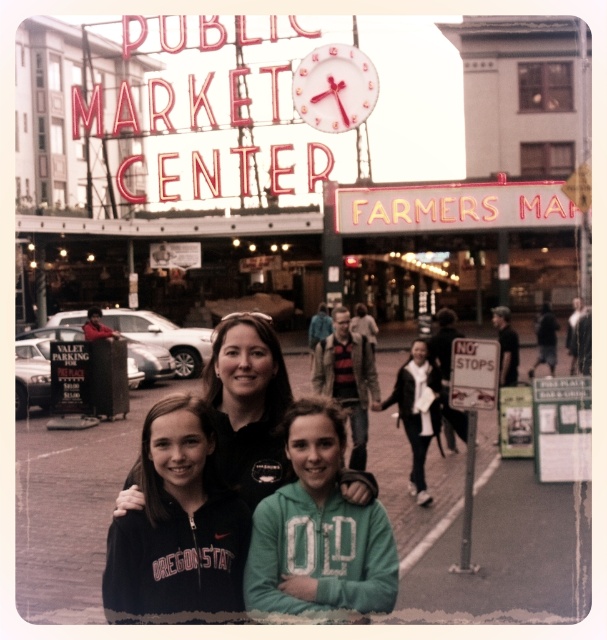
Who is more distant from viewer, (472, 220) or (489, 396)?

The point (472, 220) is more distant.

Is neon sign at center bigger than no stops" sign at lower right?

Yes, neon sign at center is bigger than no stops" sign at lower right.

Where is `neon sign at center`? This screenshot has width=607, height=640. neon sign at center is located at coordinates (452, 205).

Which is more to the left, neon sign at center or green paper sign at right?

Positioned to the left is neon sign at center.

Looking at this image, who is positioned more to the right, neon sign at center or green paper sign at right?

Positioned to the right is green paper sign at right.

Does point (395, 227) lie in front of point (589, 477)?

No.

The height and width of the screenshot is (640, 607). Find the location of `neon sign at center`. neon sign at center is located at coordinates (452, 205).

The width and height of the screenshot is (607, 640). Describe the element at coordinates (248, 406) in the screenshot. I see `black matte jacket at center` at that location.

Identify the location of black matte jacket at center. This screenshot has width=607, height=640. tap(248, 406).

You are a GUI agent. You are given a task and a screenshot of the screen. Output one action in this format:
    pyautogui.click(x=<x>, y=<y>)
    Task: Click on the black matte jacket at center
    The width and height of the screenshot is (607, 640).
    Given the screenshot: What is the action you would take?
    pyautogui.click(x=248, y=406)

I want to click on black matte jacket at center, so click(248, 406).